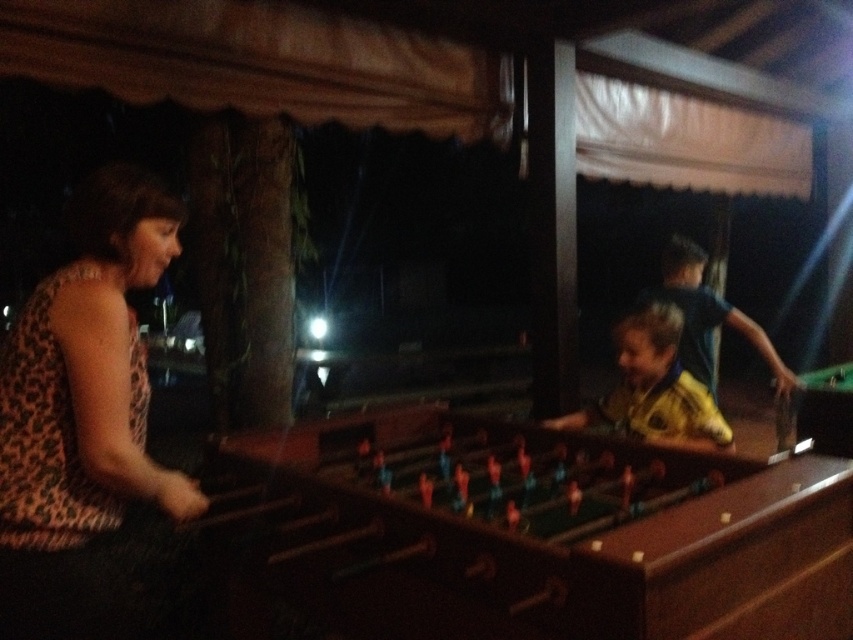
You are standing in front of the foosball table and want to place a small sticker on the table. You have two points to choose from on the table surface. Which point is closer to you, point (397,483) or point (634,380)?

Point (397,483) is closer to the camera than point (634,380), so you should place the sticker on point (397,483) as it is closer to you.

You are a photographer standing behind the brown wooden foosball table at center and want to take a picture of the yellow jersey at center. Since the table is in the way, can you move it out of the frame? Explain why or why not based on their sizes.

The brown wooden foosball table at center has a larger size compared to the yellow jersey at center. Since the table is bigger, moving it might not be feasible, so you might need to adjust your position instead.